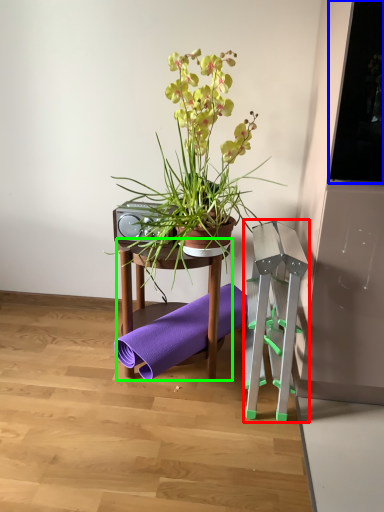
Question: Based on their relative distances, which object is nearer to step stool (highlighted by a red box)? Choose from window screen (highlighted by a blue box) and table (highlighted by a green box).

Choices:
 (A) window screen
 (B) table

Answer: (B)